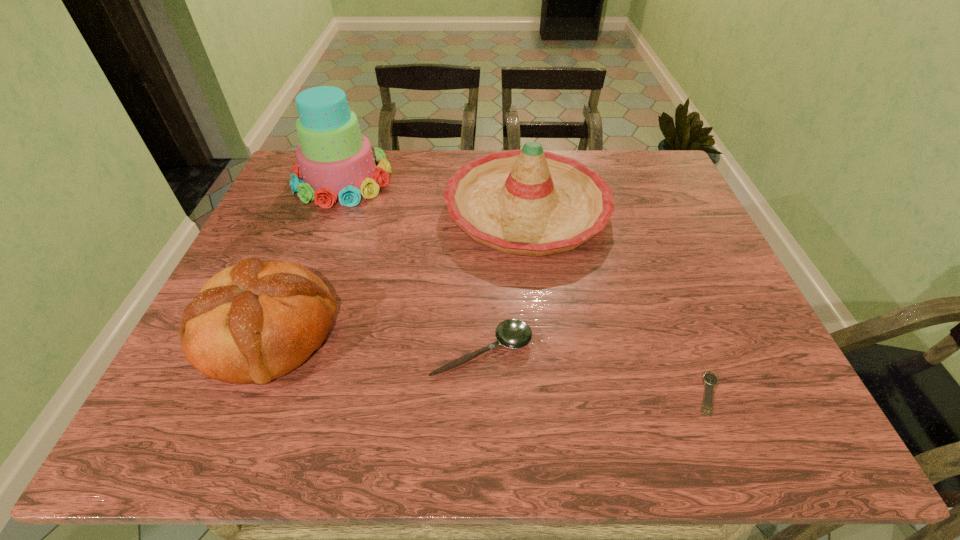
You are a GUI agent. You are given a task and a screenshot of the screen. Output one action in this format:
    pyautogui.click(x=<x>, y=<y>)
    Task: Click on the free location at the near edge
    
    Given the screenshot: What is the action you would take?
    pyautogui.click(x=591, y=446)

At what (x,y) coordinates should I click in order to perform the action: click on vacant space at the left edge of the desktop. Please return your answer as a coordinate pair (x, y). Image resolution: width=960 pixels, height=540 pixels. Looking at the image, I should click on (267, 256).

The width and height of the screenshot is (960, 540). I want to click on blank space at the right edge of the desktop, so click(x=742, y=359).

Identify the location of free area in between the shortest object and the cake. The image size is (960, 540). (526, 286).

Locate an element on the screen. unoccupied area between the bread and the second shortest object is located at coordinates (375, 342).

At what (x,y) coordinates should I click in order to perform the action: click on unoccupied area between the second tallest object and the watch. Please return your answer as a coordinate pair (x, y). Looking at the image, I should click on (617, 302).

This screenshot has width=960, height=540. Find the location of `empty space that is in between the shortest object and the fourth tallest object`. empty space that is in between the shortest object and the fourth tallest object is located at coordinates (595, 372).

What are the coordinates of `free area in between the ladle and the bread` in the screenshot? It's located at (375, 342).

Identify the location of free spot between the fourth shortest object and the shortest object. The width and height of the screenshot is (960, 540). (617, 302).

Identify the location of blank region between the watch and the third shortest object. (489, 363).